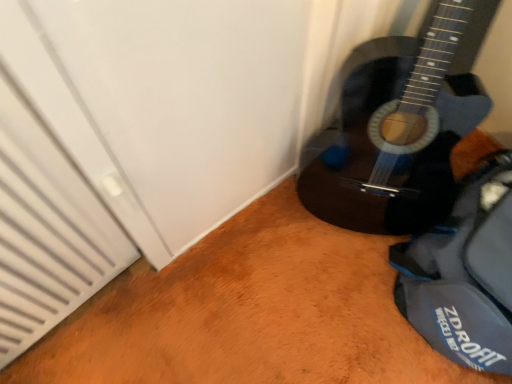
Question: Looking at their shapes, would you say blue fabric messenger bag at lower right is wider or thinner than glossy dark wood guitar at lower right?

Choices:
 (A) wide
 (B) thin

Answer: (A)

Question: Considering the positions of blue fabric messenger bag at lower right and glossy dark wood guitar at lower right in the image, is blue fabric messenger bag at lower right bigger or smaller than glossy dark wood guitar at lower right?

Choices:
 (A) big
 (B) small

Answer: (B)

Question: Would you say blue fabric messenger bag at lower right is inside or outside glossy dark wood guitar at lower right?

Choices:
 (A) outside
 (B) inside

Answer: (A)

Question: In terms of size, does glossy dark wood guitar at lower right appear bigger or smaller than blue fabric messenger bag at lower right?

Choices:
 (A) small
 (B) big

Answer: (B)

Question: Based on their positions, is glossy dark wood guitar at lower right located to the left or right of blue fabric messenger bag at lower right?

Choices:
 (A) right
 (B) left

Answer: (B)

Question: From the image's perspective, is glossy dark wood guitar at lower right located above or below blue fabric messenger bag at lower right?

Choices:
 (A) below
 (B) above

Answer: (B)

Question: Considering the positions of point (464, 1) and point (439, 291), is point (464, 1) closer or farther from the camera than point (439, 291)?

Choices:
 (A) farther
 (B) closer

Answer: (B)